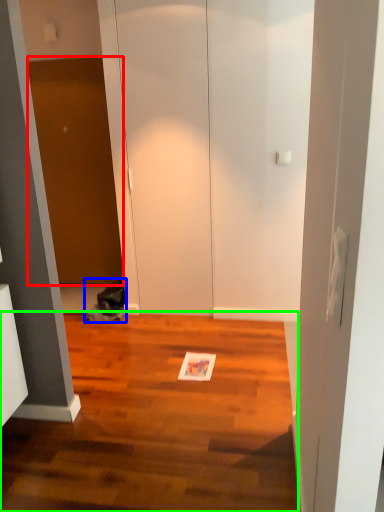
Question: Considering the real-world distances, which object is closest to door (highlighted by a red box)? cat (highlighted by a blue box) or hardwood (highlighted by a green box).

Choices:
 (A) cat
 (B) hardwood

Answer: (A)